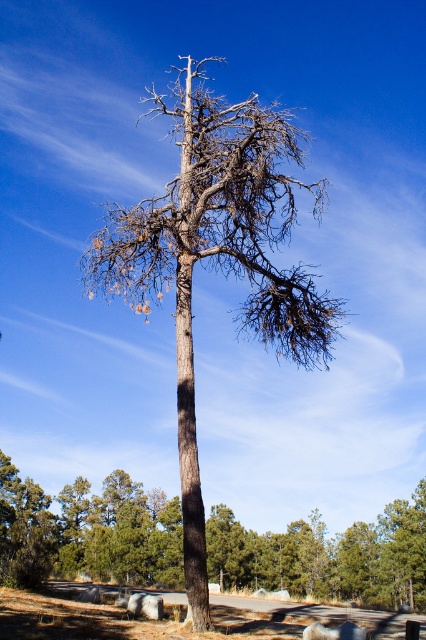
Question: Does brown rough bark tree at center appear over brown bark tree at center?

Choices:
 (A) no
 (B) yes

Answer: (B)

Question: Among these objects, which one is nearest to the camera?

Choices:
 (A) brown rough bark tree at center
 (B) brown bark tree at center

Answer: (A)

Question: Can you confirm if brown rough bark tree at center is thinner than brown bark tree at center?

Choices:
 (A) no
 (B) yes

Answer: (B)

Question: Can you confirm if brown rough bark tree at center is thinner than brown bark tree at center?

Choices:
 (A) no
 (B) yes

Answer: (B)